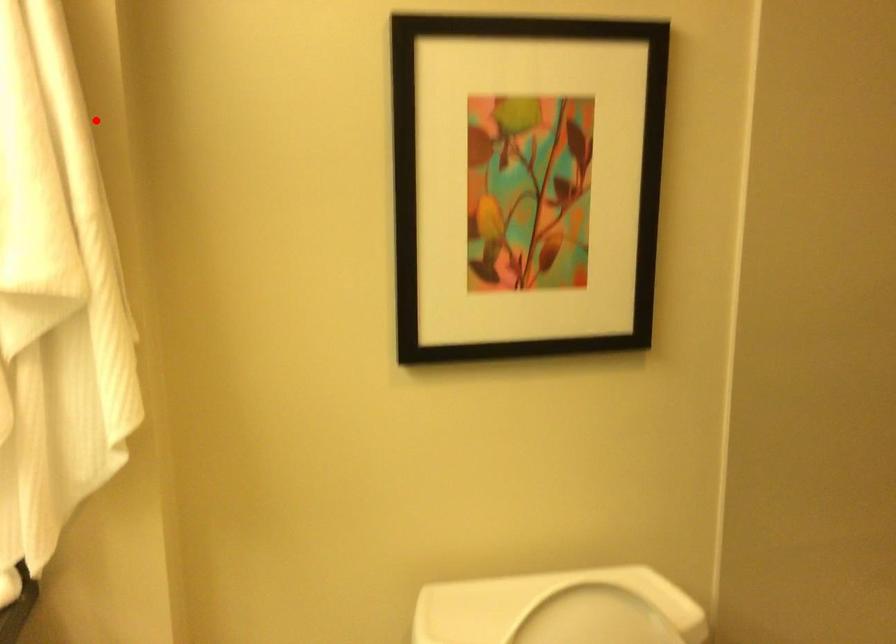
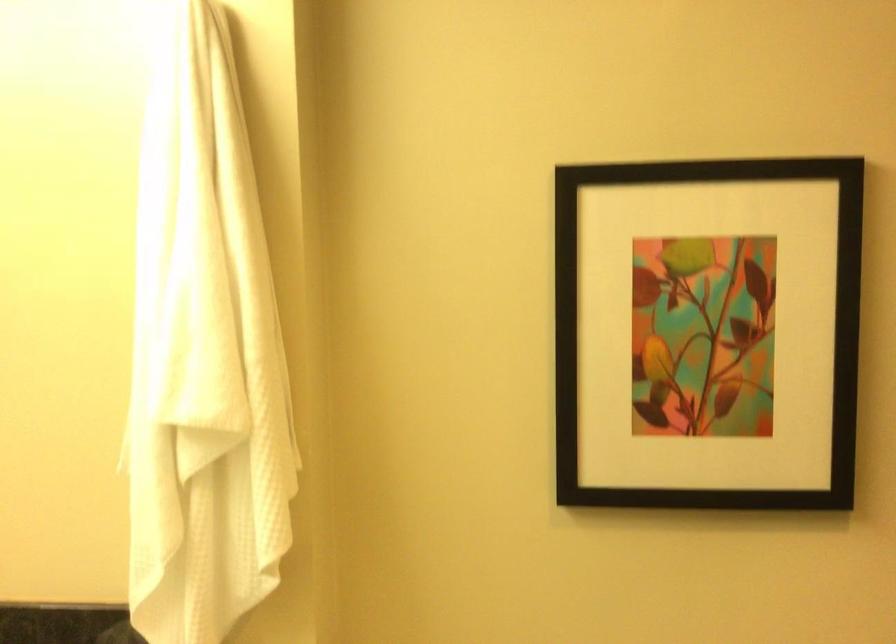
Question: I am providing you with two images of the same scene from different viewpoints. Image1 has a red point marked. In image2, the corresponding 3D location appears at what relative position? Reply with the corresponding letter.

Choices:
 (A) Closer
 (B) Farther

Answer: (B)